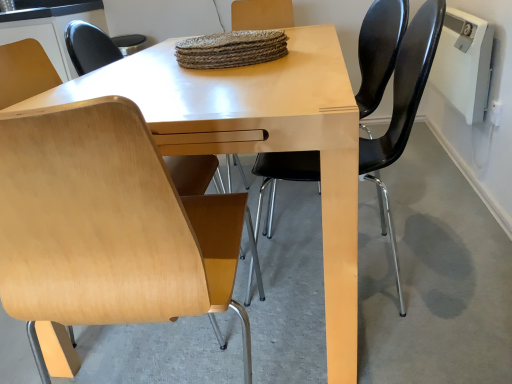
Where is `free spot below black leather chair at right, which appears as the first chair when viewed from the right (from a real-world perspective)`? The image size is (512, 384). free spot below black leather chair at right, which appears as the first chair when viewed from the right (from a real-world perspective) is located at coordinates (380, 273).